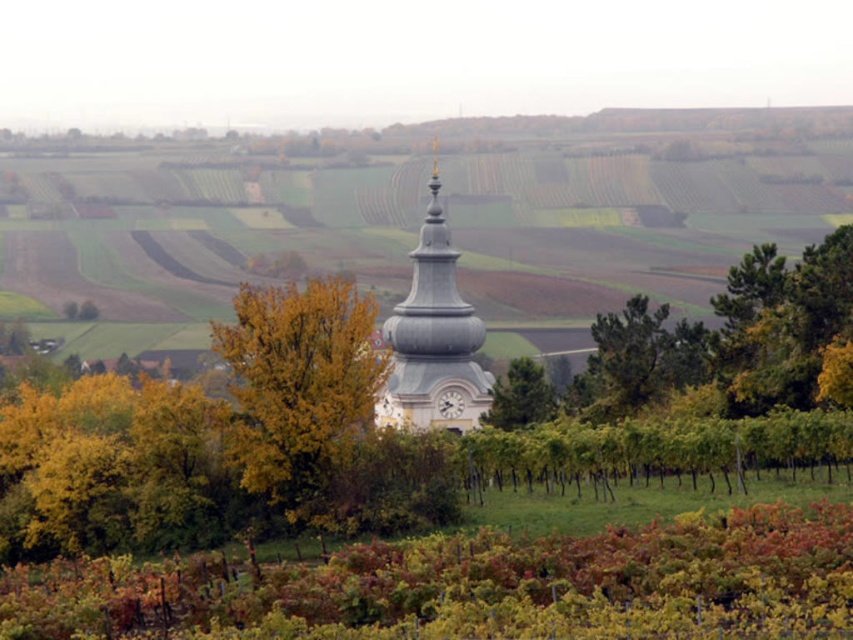
Question: Is white stucco clock tower at center smaller than green leafy tree at center?

Choices:
 (A) yes
 (B) no

Answer: (B)

Question: Which point appears farthest from the camera in this image?

Choices:
 (A) (245, 461)
 (B) (497, 396)

Answer: (B)

Question: Can you confirm if yellow leafy tree at center is positioned below green leafy tree at center?

Choices:
 (A) no
 (B) yes

Answer: (A)

Question: Does yellow leafy tree at center have a smaller size compared to white stucco clock tower at center?

Choices:
 (A) no
 (B) yes

Answer: (B)

Question: Which of these objects is positioned closest to the yellow leafy tree at center?

Choices:
 (A) white stucco clock tower at center
 (B) green leafy tree at center

Answer: (B)

Question: Which object appears closest to the camera in this image?

Choices:
 (A) white stucco clock tower at center
 (B) yellow leafy tree at center
 (C) green leafy tree at center

Answer: (B)